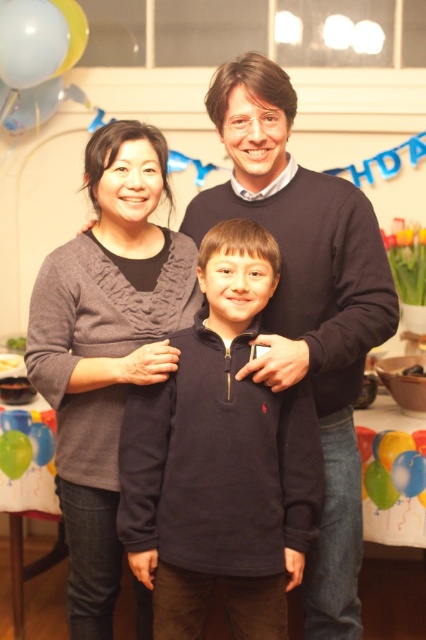
Who is more forward, (124,525) or (333,467)?

Positioned in front is point (124,525).

Can you confirm if dark blue fleece at center is shorter than dark blue sweater at center?

Yes.

Where is `dark blue fleece at center`? Image resolution: width=426 pixels, height=640 pixels. dark blue fleece at center is located at coordinates (221, 461).

Image resolution: width=426 pixels, height=640 pixels. Find the location of `dark blue fleece at center`. dark blue fleece at center is located at coordinates (221, 461).

Who is higher up, dark blue fleece at center or knitted gray sweater at center?

knitted gray sweater at center is higher up.

Which is behind, point (195, 509) or point (100, 304)?

The point (100, 304) is behind.

The image size is (426, 640). Identify the location of dark blue fleece at center. (221, 461).

Can you confirm if dark blue sweater at center is positioned to the left of knitted gray sweater at center?

In fact, dark blue sweater at center is to the right of knitted gray sweater at center.

Can you confirm if dark blue sweater at center is shorter than knitted gray sweater at center?

No.

Measure the distance between point (281, 168) and camera.

The distance of point (281, 168) from camera is 5.14 feet.

Where is `dark blue sweater at center`? dark blue sweater at center is located at coordinates (307, 305).